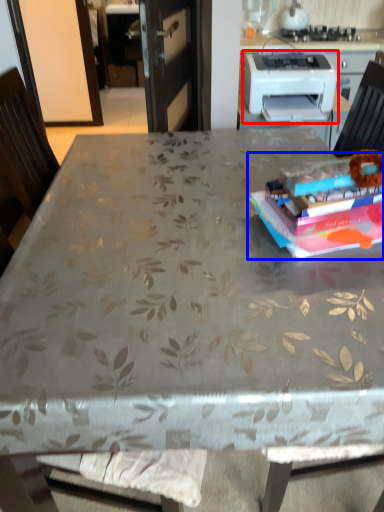
Question: Which object is further to the camera taking this photo, printer (highlighted by a red box) or paperback book (highlighted by a blue box)?

Choices:
 (A) printer
 (B) paperback book

Answer: (A)